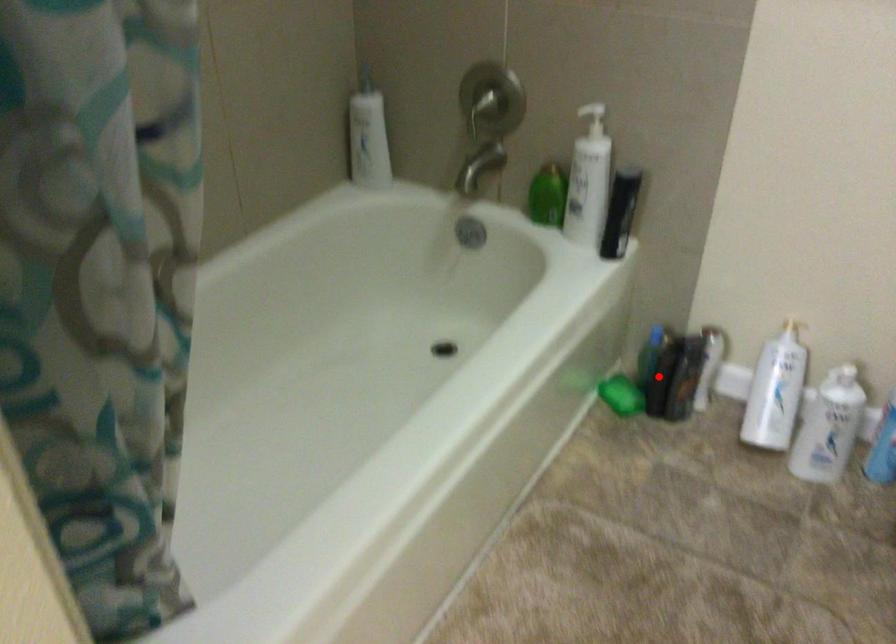
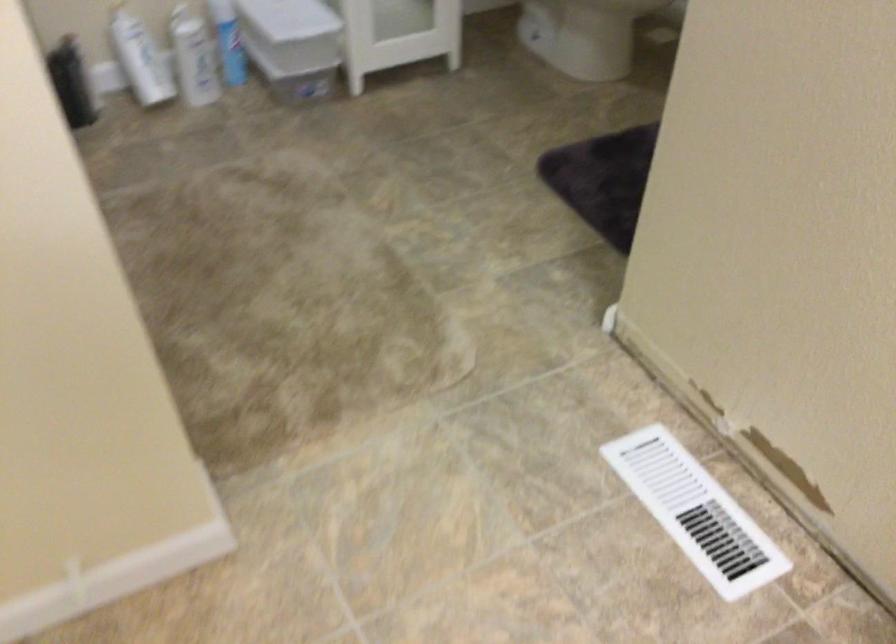
Question: I am providing you with two images of the same scene from different viewpoints. In image1, a red point is highlighted. Considering the same 3D point in image2, which of the following is correct?

Choices:
 (A) It is closer
 (B) It is farther

Answer: (B)